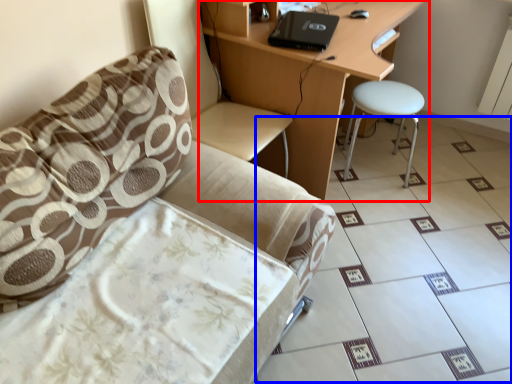
Question: Which object is closer to the camera taking this photo, desk (highlighted by a red box) or ceramic tile (highlighted by a blue box)?

Choices:
 (A) desk
 (B) ceramic tile

Answer: (B)